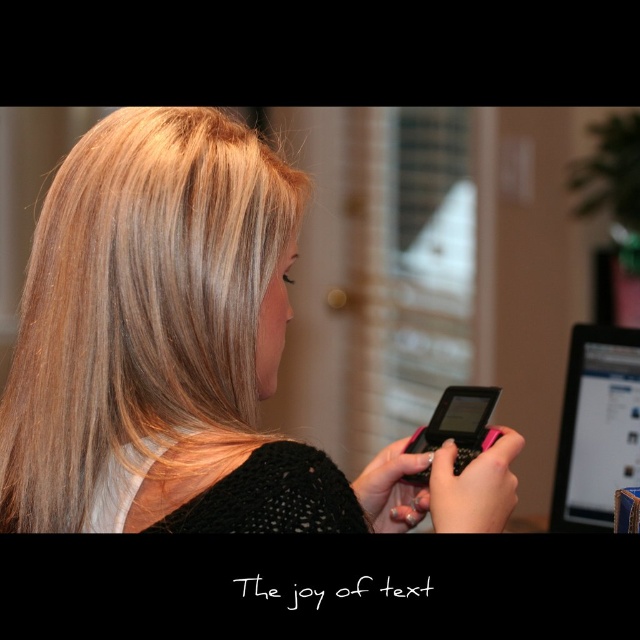
You are a photographer setting up a shot of the woman in the scene. You notice the blonde hair at center and the matte black computer at right. Which object would appear bigger in the final photo?

The blonde hair at center would appear bigger in the final photo because it has a larger size compared to the matte black computer at right.

You are standing in the room and see two points marked in the image. The first point is at coordinate point (284, 246) and the second is at point (568, 522). Which point is closer to you?

Point (284, 246) is in front of point (568, 522), so it is closer to you.